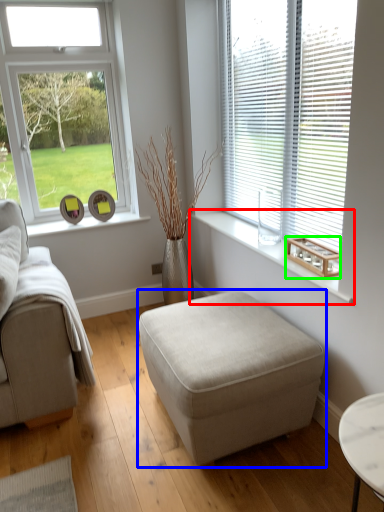
Question: Considering the real-world distances, which object is farthest from window sill (highlighted by a red box)? table (highlighted by a blue box) or wood (highlighted by a green box)?

Choices:
 (A) table
 (B) wood

Answer: (A)